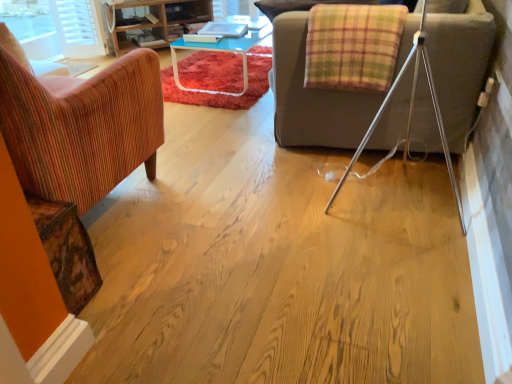
Question: From a real-world perspective, relative to wooden shelves at upper left, is wooden textured armchair at left vertically above or below?

Choices:
 (A) below
 (B) above

Answer: (B)

Question: Is point (121, 173) positioned closer to the camera than point (131, 29)?

Choices:
 (A) closer
 (B) farther

Answer: (A)

Question: Which of these objects is positioned closest to the wooden textured armchair at left?

Choices:
 (A) plaid fabric blanket at upper right
 (B) wooden shelves at upper left

Answer: (A)

Question: Which of these objects is positioned closest to the wooden textured armchair at left?

Choices:
 (A) plaid fabric blanket at upper right
 (B) wooden shelves at upper left

Answer: (A)